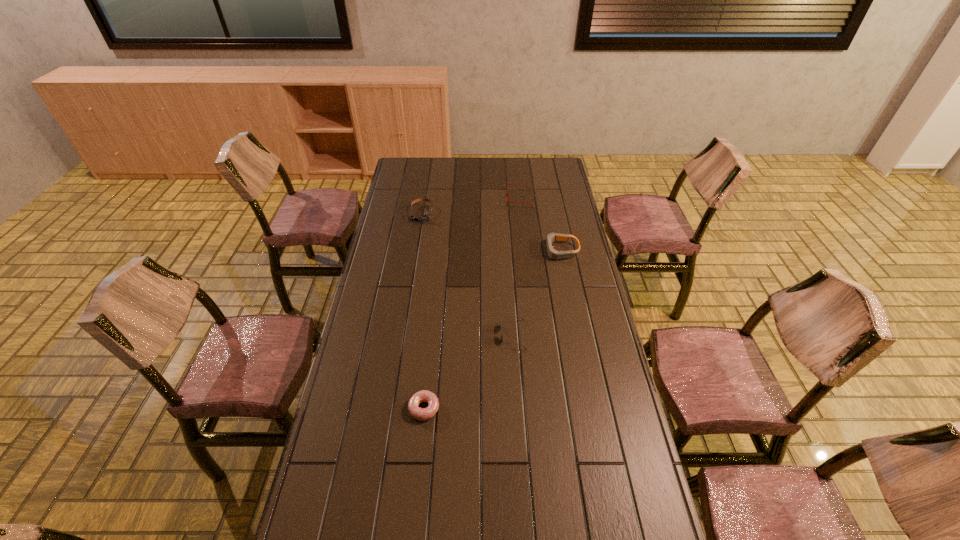
At what (x,y) coordinates should I click in order to perform the action: click on spectacles. Please return your answer as a coordinate pair (x, y). Looking at the image, I should click on (508, 184).

This screenshot has height=540, width=960. Find the location of `the fourth nearest object`. the fourth nearest object is located at coordinates (552, 253).

Find the location of a particular element. The image size is (960, 540). the rightmost object is located at coordinates (552, 253).

Locate an element on the screen. the farther goggles is located at coordinates (426, 216).

Where is `the leftmost object`? Image resolution: width=960 pixels, height=540 pixels. the leftmost object is located at coordinates (426, 216).

Where is `the fifth farthest object`? The image size is (960, 540). the fifth farthest object is located at coordinates (421, 414).

Identify the location of doughnut. (421, 414).

Where is `the farther sunglasses`? The height and width of the screenshot is (540, 960). the farther sunglasses is located at coordinates (515, 316).

Where is `the taller sunglasses`? the taller sunglasses is located at coordinates (515, 316).

Find the location of `vacant space located on the face of the spectacles`. vacant space located on the face of the spectacles is located at coordinates (489, 199).